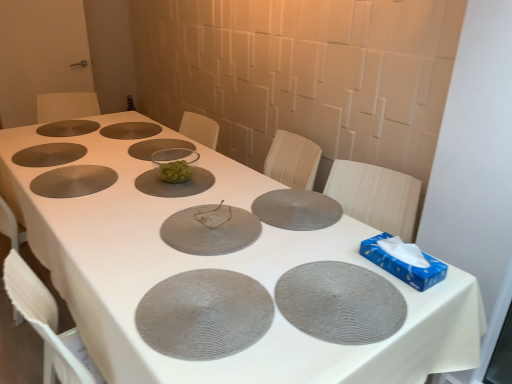
Image resolution: width=512 pixels, height=384 pixels. What are the coordinates of `unoccupied region to the right of matte gray plate at upper left, which is the 7th glass plate in front-to-back order` in the screenshot? It's located at (95, 158).